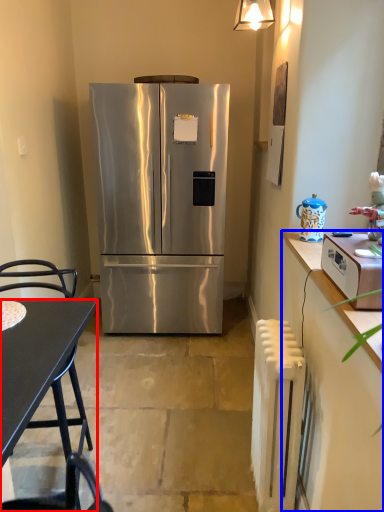
Question: Which object appears closest to the camera in this image, desk (highlighted by a red box) or cabinetry (highlighted by a blue box)?

Choices:
 (A) desk
 (B) cabinetry

Answer: (B)